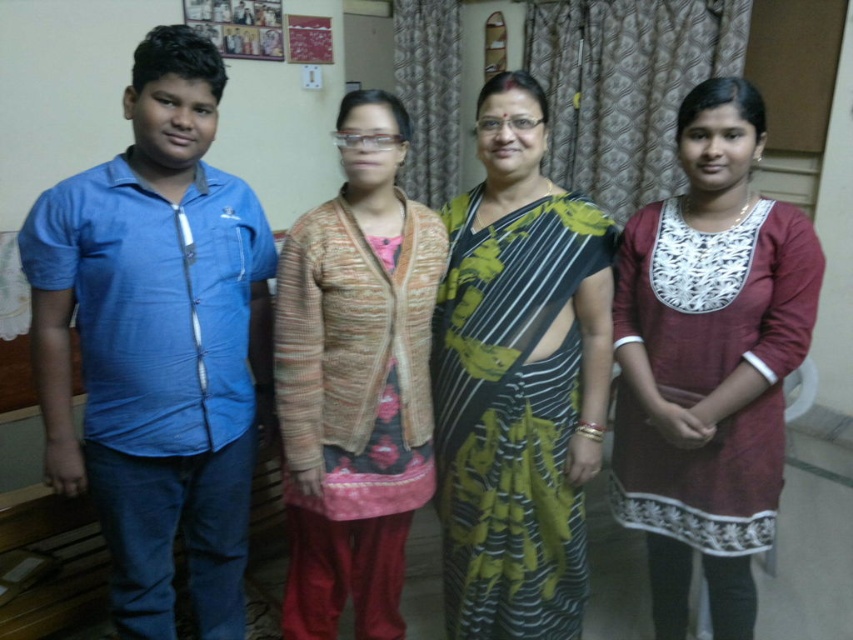
You are trying to locate the blue cotton shirt at left in the room. Based on the coordinates provided, where would you find it?

The blue cotton shirt at left is located at coordinates point (157, 342).

You are a photographer setting up a photo shoot in this room. You need to position two models wearing the blue cotton shirt at left and maroon cotton kurta at right. Since you want them to be in the frame without overlapping, which model should you place closer to the edge of the frame to avoid overlap?

The blue cotton shirt at left should be placed closer to the edge of the frame because it is wider than the maroon cotton kurta at right, reducing the chance of overlap.